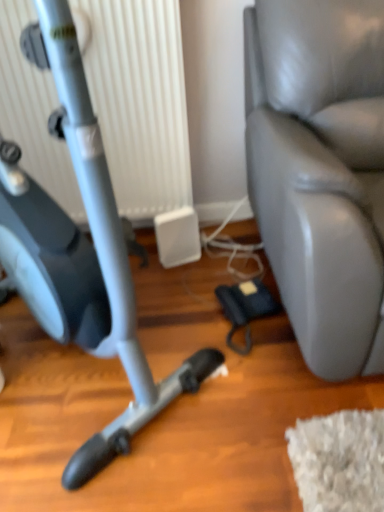
At what (x,y) coordinates should I click in order to perform the action: click on free region under matte gray stationary bicycle at left (from a real-world perspective). Please return your answer as a coordinate pair (x, y). The image size is (384, 512). Looking at the image, I should click on point(78,369).